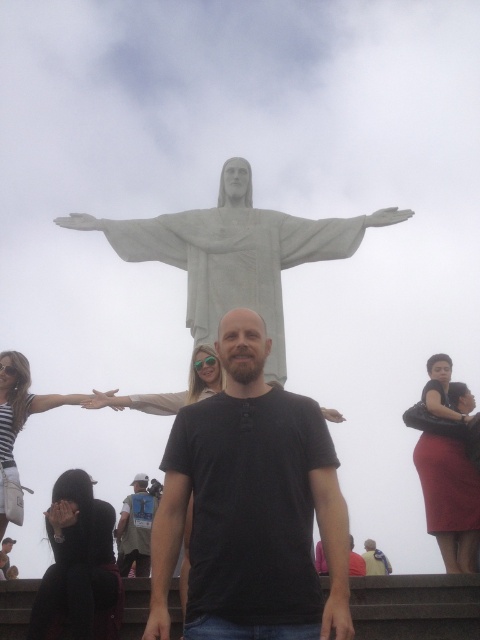
Where is `matte red skirt at lower right`? matte red skirt at lower right is located at coordinates (450, 499).

Who is more forward, [421,458] or [159,563]?

Positioned in front is point [159,563].

Image resolution: width=480 pixels, height=640 pixels. What are the coordinates of `matte red skirt at lower right` in the screenshot? It's located at (450, 499).

Which is behind, point (82, 515) or point (25, 380)?

The point (25, 380) is more distant.

Does point (63, 588) come farther from viewer compared to point (0, 524)?

No, (63, 588) is closer to viewer.

Locate an element on the screen. Image resolution: width=480 pixels, height=640 pixels. black matte hair at lower left is located at coordinates (76, 563).

Is the position of striped fabric shirt at lower left more distant than that of black matte arm at center?

Yes, striped fabric shirt at lower left is further from the viewer.

Who is lower down, striped fabric shirt at lower left or black matte arm at center?

black matte arm at center

What do you see at coordinates (21, 403) in the screenshot? I see `striped fabric shirt at lower left` at bounding box center [21, 403].

You are a GUI agent. You are given a task and a screenshot of the screen. Output one action in this format:
    pyautogui.click(x=<x>, y=<y>)
    Task: Click on the striped fabric shirt at lower left
    The height and width of the screenshot is (640, 480).
    Given the screenshot: What is the action you would take?
    (21, 403)